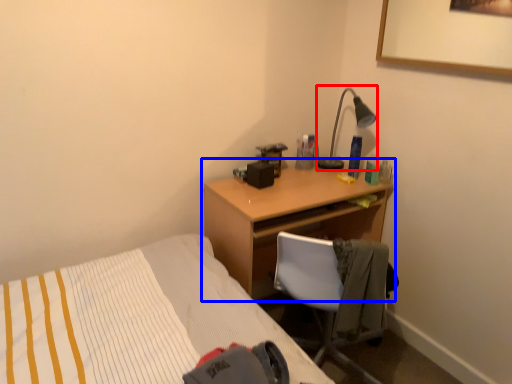
Question: Which object appears farthest to the camera in this image, lamp (highlighted by a red box) or desk (highlighted by a blue box)?

Choices:
 (A) lamp
 (B) desk

Answer: (A)